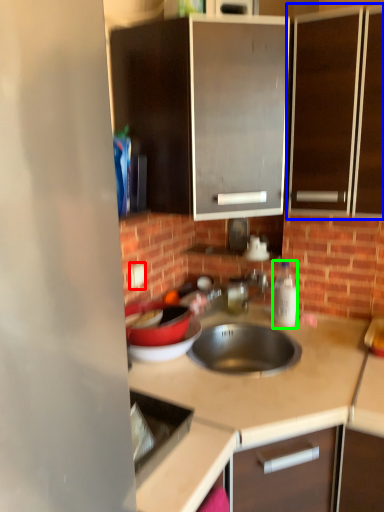
Question: Estimate the real-world distances between objects in this image. Which object is closer to electric outlet (highlighted by a red box), cabinetry (highlighted by a blue box) or bottle (highlighted by a green box)?

Choices:
 (A) cabinetry
 (B) bottle

Answer: (B)